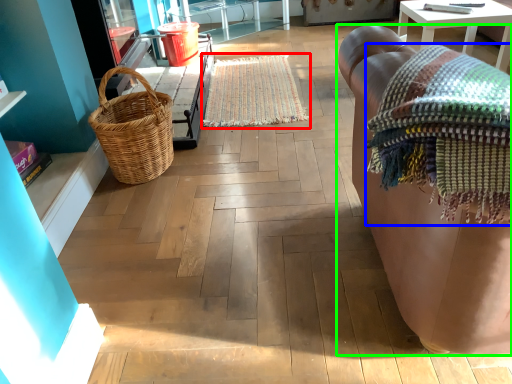
Question: Which object is positioned closest to mat (highlighted by a red box)? Select from blanket (highlighted by a blue box) and studio couch (highlighted by a green box).

Choices:
 (A) blanket
 (B) studio couch

Answer: (B)